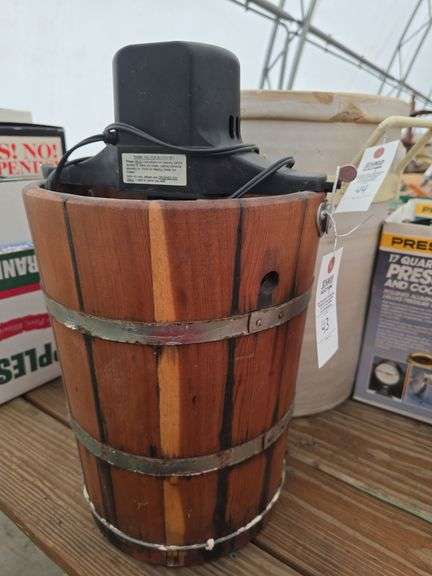
I want to click on grooves between the wood planks, so click(272, 555), click(385, 504), click(68, 568).